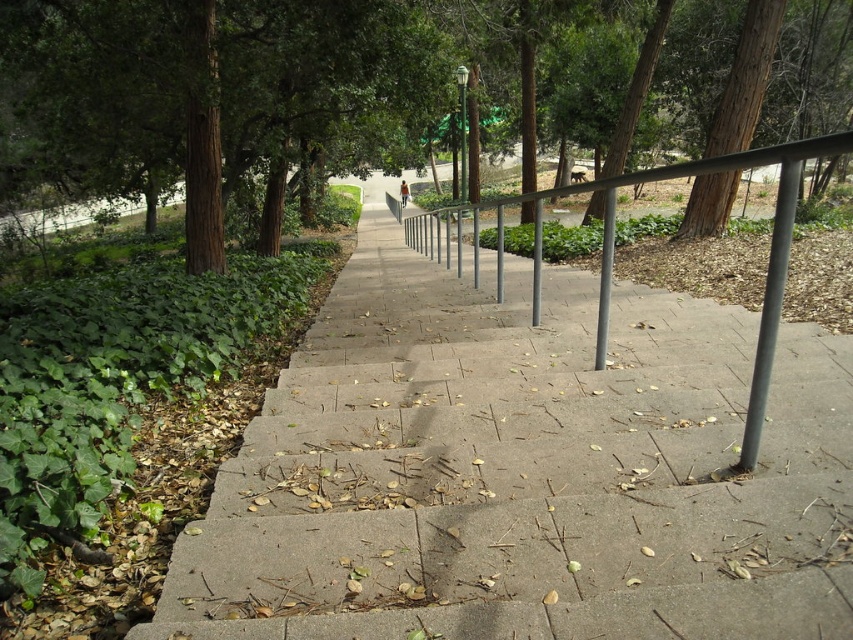
Is concrete at center behind gray metallic pole at right?

No, it is not.

Does point (616, 336) come farther from viewer compared to point (770, 310)?

Yes.

Locate an element on the screen. The height and width of the screenshot is (640, 853). concrete at center is located at coordinates (523, 472).

Does concrete at center have a greater height compared to metallic gray balustrade at center?

Incorrect, concrete at center's height is not larger of metallic gray balustrade at center's.

Is concrete at center positioned in front of metallic gray balustrade at center?

Yes.

The width and height of the screenshot is (853, 640). In order to click on concrete at center in this screenshot , I will do `click(523, 472)`.

Find the location of a particular element. concrete at center is located at coordinates (523, 472).

Who is shorter, concrete at center or brown textured tree at upper left?

Standing shorter between the two is concrete at center.

Is point (480, 515) farther from viewer compared to point (247, 28)?

No, it is in front of (247, 28).

What are the coordinates of `concrete at center` in the screenshot? It's located at (523, 472).